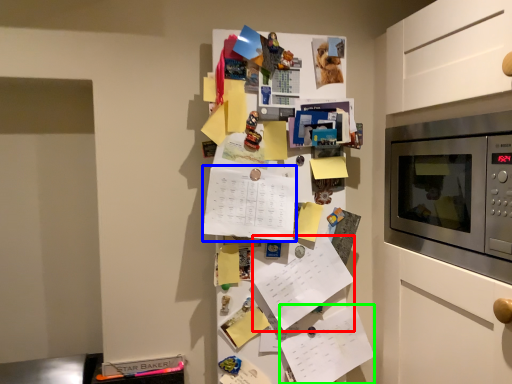
Question: Which is nearer to the list (highlighted by a red box)? list (highlighted by a blue box) or list (highlighted by a green box).

Choices:
 (A) list
 (B) list

Answer: (B)